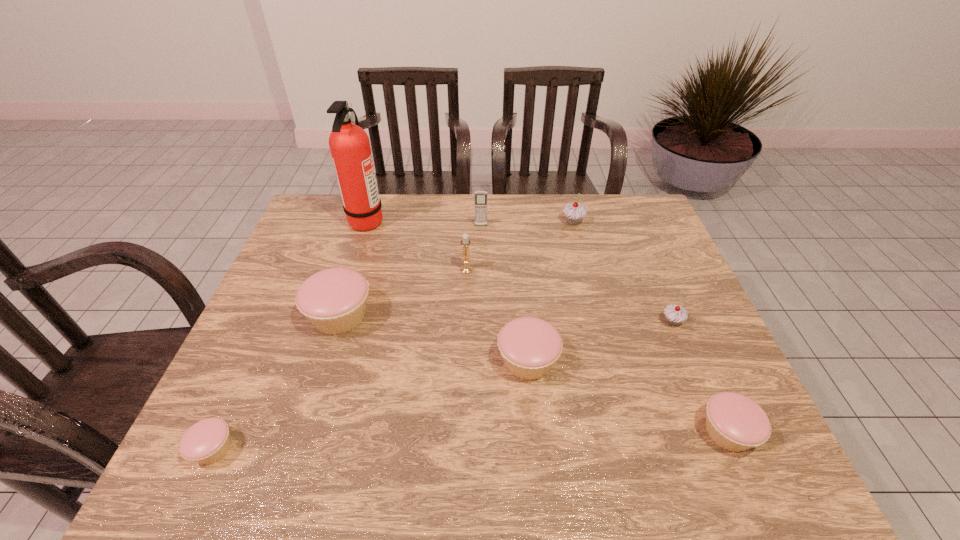
Select which object is the fourth closest to the biggest pink cupcake. Please provide its 2D coordinates. Your answer should be formatted as a tuple, i.e. [(x, y)], where the tuple contains the x and y coordinates of a point satisfying the conditions above.

[(530, 346)]

Where is `cupcake that stands as the third closest to the fourth cupcake from right to left`? cupcake that stands as the third closest to the fourth cupcake from right to left is located at coordinates [334, 300].

You are a GUI agent. You are given a task and a screenshot of the screen. Output one action in this format:
    pyautogui.click(x=<x>, y=<y>)
    Task: Click on the cupcake that stands as the third closest to the second shortest cupcake
    This screenshot has height=540, width=960.
    Given the screenshot: What is the action you would take?
    (574, 213)

Select which pink cupcake is the third closest to the biggest pink cupcake. Please provide its 2D coordinates. Your answer should be formatted as a tuple, i.e. [(x, y)], where the tuple contains the x and y coordinates of a point satisfying the conditions above.

[(734, 422)]

Where is `pink cupcake object that ranks as the third closest to the tallest object`? pink cupcake object that ranks as the third closest to the tallest object is located at coordinates (207, 441).

This screenshot has height=540, width=960. I want to click on free spot that satisfies the following two spatial constraints: 1. on the handle side of the third pink cupcake from right to left; 2. on the right side of the tallest object, so click(336, 316).

Where is `blank area in the image that satisfies the following two spatial constraints: 1. on the back side of the eighth tallest object; 2. on the handle side of the red fire extinguisher`? This screenshot has height=540, width=960. blank area in the image that satisfies the following two spatial constraints: 1. on the back side of the eighth tallest object; 2. on the handle side of the red fire extinguisher is located at coordinates (636, 220).

Identify the location of vacant space that satisfies the following two spatial constraints: 1. on the handle side of the second cupcake from left to right; 2. on the right side of the red fire extinguisher. This screenshot has width=960, height=540. (336, 316).

Locate an element on the screen. free location that satisfies the following two spatial constraints: 1. on the back side of the second cupcake from left to right; 2. on the left side of the leftmost cupcake is located at coordinates (274, 316).

The width and height of the screenshot is (960, 540). I want to click on vacant space that satisfies the following two spatial constraints: 1. on the back side of the fourth object from left to right; 2. on the left side of the leftmost object, so click(295, 269).